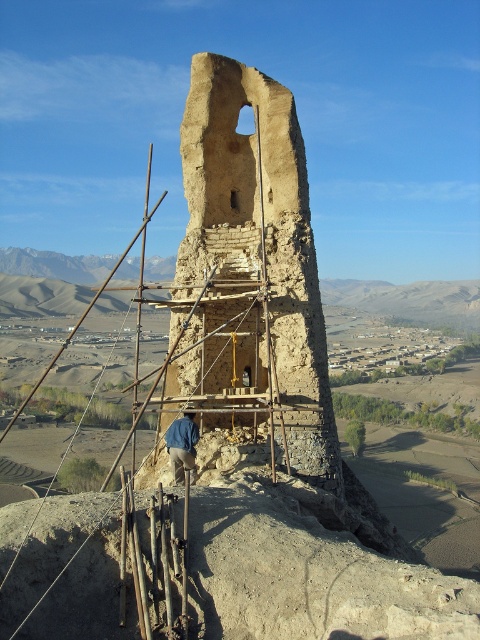
Question: Does earthy brown stone tower at center have a lesser width compared to blue denim jacket at center?

Choices:
 (A) no
 (B) yes

Answer: (A)

Question: Among these points, which one is nearest to the camera?

Choices:
 (A) [181, 461]
 (B) [171, 307]

Answer: (A)

Question: Is earthy brown stone tower at center positioned behind blue denim jacket at center?

Choices:
 (A) yes
 (B) no

Answer: (B)

Question: Which of the following is the farthest from the observer?

Choices:
 (A) (178, 436)
 (B) (168, 305)

Answer: (B)

Question: Does earthy brown stone tower at center lie behind blue denim jacket at center?

Choices:
 (A) no
 (B) yes

Answer: (A)